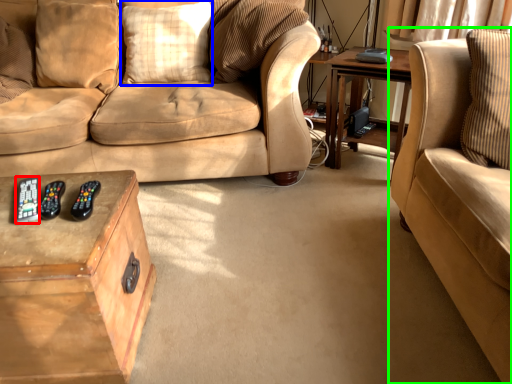
Question: Estimate the real-world distances between objects in this image. Which object is farther from remote (highlighted by a red box), pillow (highlighted by a blue box) or studio couch (highlighted by a green box)?

Choices:
 (A) pillow
 (B) studio couch

Answer: (B)